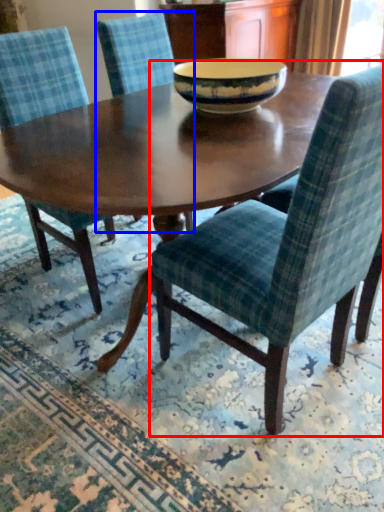
Question: Which point is further to the camera, chair (highlighted by a red box) or chair (highlighted by a blue box)?

Choices:
 (A) chair
 (B) chair

Answer: (B)